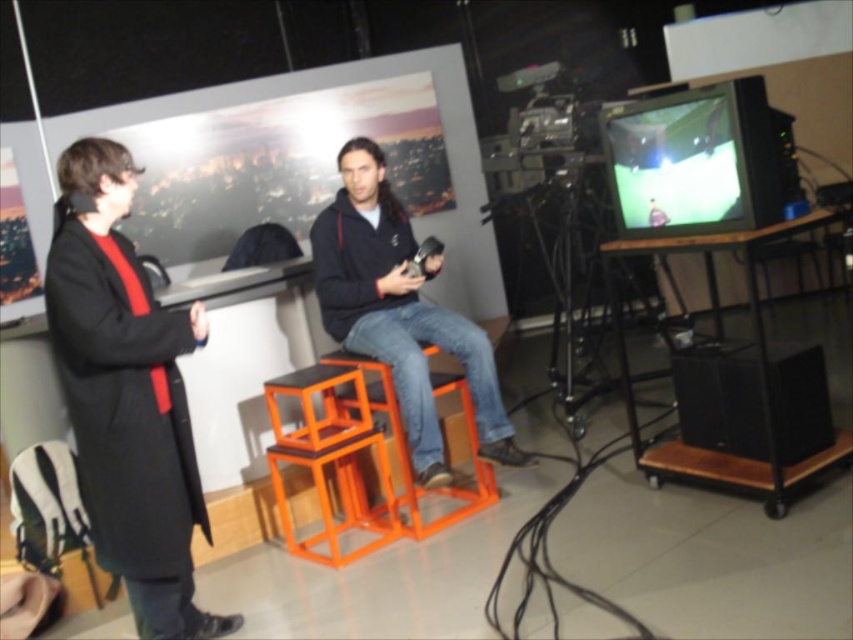
Is matte black coat at left closer to camera compared to orange metallic bar stool at center?

Yes, it is.

Find the location of a particular element. This screenshot has width=853, height=640. matte black coat at left is located at coordinates (126, 394).

At what (x,y) coordinates should I click in order to perform the action: click on matte black coat at left. Please return your answer as a coordinate pair (x, y). Image resolution: width=853 pixels, height=640 pixels. Looking at the image, I should click on (126, 394).

Where is `matte black coat at left`? matte black coat at left is located at coordinates (126, 394).

Is matte black coat at left in front of orange plastic chair at lower left?

That is True.

Image resolution: width=853 pixels, height=640 pixels. What do you see at coordinates (126, 394) in the screenshot? I see `matte black coat at left` at bounding box center [126, 394].

Who is more distant from viewer, (x=119, y=468) or (x=80, y=500)?

Positioned behind is point (x=80, y=500).

The image size is (853, 640). I want to click on matte black coat at left, so click(x=126, y=394).

Locate an element on the screen. The height and width of the screenshot is (640, 853). matte black coat at left is located at coordinates (126, 394).

Is matte black coat at left further to camera compared to matte black jacket at center?

That is False.

Between point (154, 452) and point (415, 403), which one is positioned in front?

Positioned in front is point (154, 452).

You are a GUI agent. You are given a task and a screenshot of the screen. Output one action in this format:
    pyautogui.click(x=<x>, y=<y>)
    Task: Click on the matte black coat at left
    Image resolution: width=853 pixels, height=640 pixels.
    Given the screenshot: What is the action you would take?
    click(x=126, y=394)